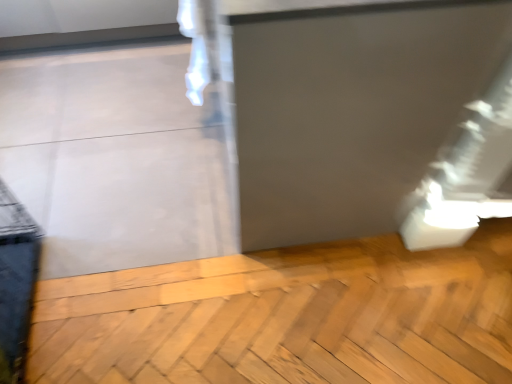
Question: Should I look upward or downward to see matte gray screen door at center?

Choices:
 (A) down
 (B) up

Answer: (B)